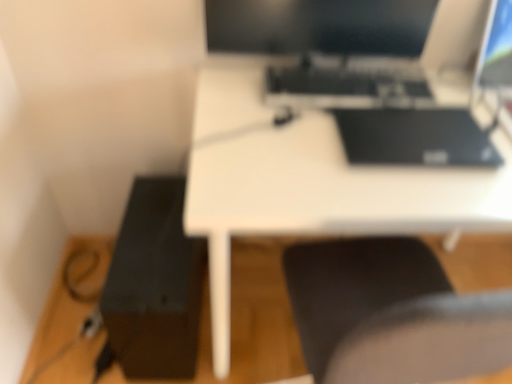
What do you see at coordinates (319, 26) in the screenshot? I see `black glossy monitor at upper center` at bounding box center [319, 26].

The height and width of the screenshot is (384, 512). Describe the element at coordinates (310, 183) in the screenshot. I see `white matte desk at center` at that location.

This screenshot has height=384, width=512. Describe the element at coordinates (346, 83) in the screenshot. I see `black matte keyboard at center` at that location.

At what (x,y) coordinates should I click in order to perform the action: click on black matte keyboard at center. Please return your answer as a coordinate pair (x, y). Looking at the image, I should click on (346, 83).

Find the location of `black glossy monitor at upper center`. black glossy monitor at upper center is located at coordinates (319, 26).

Which of these two, black matte printer at lower left or white matte desk at center, is thinner?

black matte printer at lower left is thinner.

Is black matte printer at lower left at the left side of white matte desk at center?

Yes, black matte printer at lower left is to the left of white matte desk at center.

Is black matte printer at lower left positioned in front of white matte desk at center?

No, black matte printer at lower left is further to the viewer.

From the image's perspective, would you say black matte printer at lower left is positioned over white matte desk at center?

Actually, black matte printer at lower left appears below white matte desk at center in the image.

From the image's perspective, relative to black glossy monitor at upper center, is black matte keyboard at center above or below?

Based on their image positions, black matte keyboard at center is located beneath black glossy monitor at upper center.

Which of these two, black matte keyboard at center or black glossy monitor at upper center, is bigger?

black glossy monitor at upper center is bigger.

From a real-world perspective, does black matte keyboard at center sit lower than black glossy monitor at upper center?

Yes, from a real-world perspective, black matte keyboard at center is under black glossy monitor at upper center.

Which is more to the right, black matte keyboard at center or black glossy monitor at upper center?

Positioned to the right is black matte keyboard at center.

Considering the relative positions of black glossy monitor at upper center and black matte keyboard at center in the image provided, is black glossy monitor at upper center behind black matte keyboard at center?

No, the depth of black glossy monitor at upper center is less than that of black matte keyboard at center.

In the image, is black glossy monitor at upper center on the left side or the right side of black matte keyboard at center?

In the image, black glossy monitor at upper center appears on the left side of black matte keyboard at center.

Which of these two, black glossy monitor at upper center or black matte keyboard at center, is thinner?

With smaller width is black glossy monitor at upper center.

From a real-world perspective, who is located lower, black glossy monitor at upper center or black matte keyboard at center?

black matte keyboard at center is physically lower.

From the image's perspective, does matte black monitor at upper right appear higher than black glossy monitor at upper center?

Correct, matte black monitor at upper right appears higher than black glossy monitor at upper center in the image.

Does matte black monitor at upper right have a lesser width compared to black glossy monitor at upper center?

No, matte black monitor at upper right is not thinner than black glossy monitor at upper center.

Locate an element on the screen. The image size is (512, 384). computer monitor below the matte black monitor at upper right (from a real-world perspective) is located at coordinates (319, 26).

Could you tell me if matte black monitor at upper right is turned towards black glossy monitor at upper center?

No, matte black monitor at upper right is not turned towards black glossy monitor at upper center.

Is matte black monitor at upper right oriented towards white matte desk at center?

No, matte black monitor at upper right is not facing towards white matte desk at center.

Does matte black monitor at upper right come in front of white matte desk at center?

No, matte black monitor at upper right is further to the viewer.

How much distance is there between matte black monitor at upper right and white matte desk at center?

matte black monitor at upper right is 21.10 inches away from white matte desk at center.

Is matte black monitor at upper right wider than white matte desk at center?

Incorrect, the width of matte black monitor at upper right does not surpass that of white matte desk at center.

Consider the image. Is white matte desk at center far away from black matte printer at lower left?

They are positioned close to each other.

Is white matte desk at center positioned with its back to black matte printer at lower left?

No.

Considering the sizes of objects white matte desk at center and black matte printer at lower left in the image provided, who is bigger, white matte desk at center or black matte printer at lower left?

white matte desk at center.

From a real-world perspective, who is located lower, white matte desk at center or black matte keyboard at center?

white matte desk at center is physically lower.

Based on their positions, is white matte desk at center located to the left or right of black matte keyboard at center?

Based on their positions, white matte desk at center is located to the right of black matte keyboard at center.

Is point (437, 226) positioned behind point (273, 73)?

No, (437, 226) is closer to viewer.

The image size is (512, 384). Identify the location of table in front of the black matte printer at lower left. (310, 183).

The width and height of the screenshot is (512, 384). What are the coordinates of `computer monitor above the black matte keyboard at center (from the image's perspective)` in the screenshot? It's located at (319, 26).

Based on their spatial positions, is matte black monitor at upper right or black matte keyboard at center further from white matte desk at center?

matte black monitor at upper right is further to white matte desk at center.

Looking at the image, which one is located further to matte black monitor at upper right, black matte keyboard at center or black matte printer at lower left?

The object further to matte black monitor at upper right is black matte printer at lower left.

When comparing their distances from matte black monitor at upper right, does white matte desk at center or black matte printer at lower left seem further?

black matte printer at lower left.

From the picture: When comparing their distances from black glossy monitor at upper center, does matte black monitor at upper right or white matte desk at center seem closer?

Based on the image, white matte desk at center appears to be nearer to black glossy monitor at upper center.

Looking at the image, which one is located further to black matte printer at lower left, white matte desk at center or matte black monitor at upper right?

matte black monitor at upper right lies further to black matte printer at lower left than the other object.

From the image, which object appears to be nearer to black matte keyboard at center, matte black monitor at upper right or black glossy monitor at upper center?

The object closer to black matte keyboard at center is black glossy monitor at upper center.

Considering their positions, is black matte keyboard at center positioned closer to black matte printer at lower left than matte black monitor at upper right?

black matte keyboard at center is positioned closer to the anchor black matte printer at lower left.

Considering their positions, is black matte printer at lower left positioned closer to matte black monitor at upper right than black matte keyboard at center?

black matte keyboard at center.

At what (x,y) coordinates should I click in order to perform the action: click on table between black matte printer at lower left and matte black monitor at upper right. Please return your answer as a coordinate pair (x, y). The image size is (512, 384). Looking at the image, I should click on (310, 183).

In order to click on laptop keyboard between black glossy monitor at upper center and black matte printer at lower left from top to bottom in this screenshot , I will do `click(346, 83)`.

Where is `laptop keyboard between black glossy monitor at upper center and white matte desk at center vertically`? The height and width of the screenshot is (384, 512). laptop keyboard between black glossy monitor at upper center and white matte desk at center vertically is located at coordinates (346, 83).

At what (x,y) coordinates should I click in order to perform the action: click on laptop keyboard located between black glossy monitor at upper center and matte black monitor at upper right in the left-right direction. Please return your answer as a coordinate pair (x, y). Looking at the image, I should click on (346, 83).